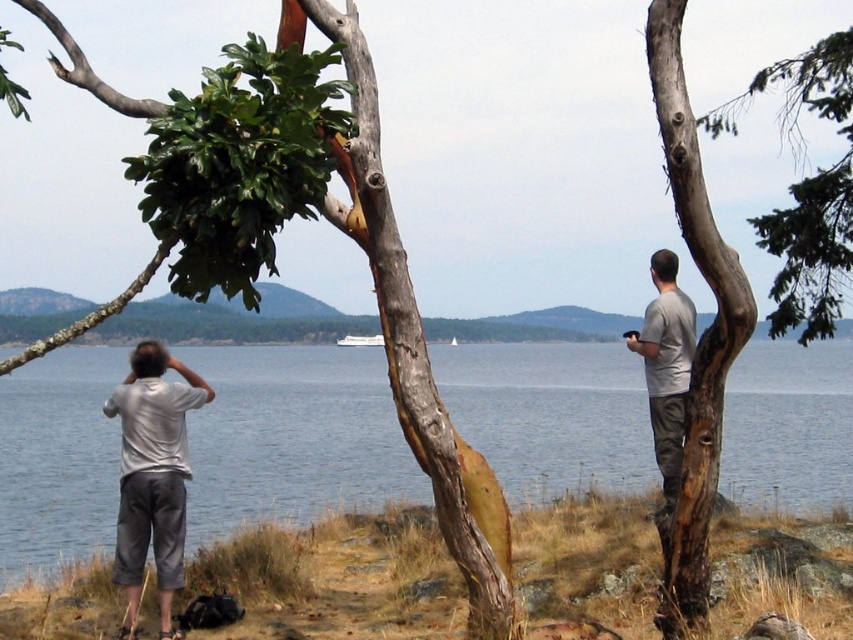
You are a photographer trying to capture a photo of the smooth bark tree trunk at right and the gray matte shirt at right. Since you want to ensure both are in focus, which object should you focus on first to account for their height difference?

The smooth bark tree trunk at right is much taller than the gray matte shirt at right, so you should focus on the smooth bark tree trunk at right first to ensure both are in focus.

You are standing at the point marked by the coordinates point (335,579). Looking towards the brown grass at lower center, which direction should you walk to reach the tree with sparse green foliage on the left side of the frame?

The brown grass at lower center is represented by point (335,579). To reach the tree with sparse green foliage on the left side of the frame from this point, you should walk towards the left side of the frame.

You are standing at the lakeside and want to walk towards the smooth bark tree trunk at right. Which direction should you move relative to the brown grass at lower center?

You should move to the right of the brown grass at lower center to reach the smooth bark tree trunk at right.